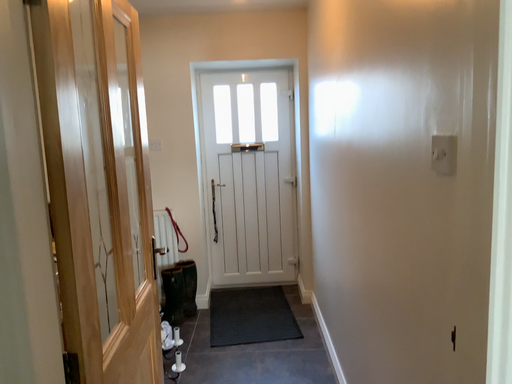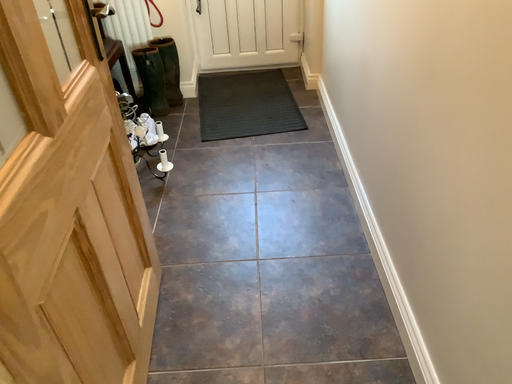
Question: Which way did the camera rotate in the video?

Choices:
 (A) rotated downward
 (B) rotated upward

Answer: (A)